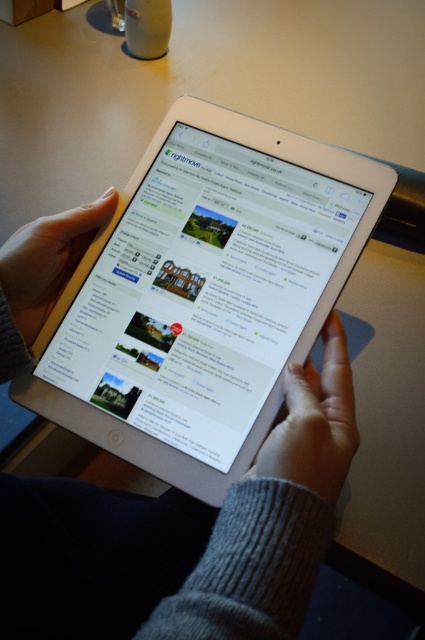
Looking at this image, you are a person who wants to check the price of the house listings on the silver metallic tablet at center. However, you notice the gray woolen sweater at lower center is blocking your view. Which object should you move to access the tablet?

You should move the gray woolen sweater at lower center because it is blocking the view of the silver metallic tablet at center, which is to the left of it.

Where is the gray woolen sweater at lower center located in the image?

The gray woolen sweater at lower center is located at point (314, 420) in the image.